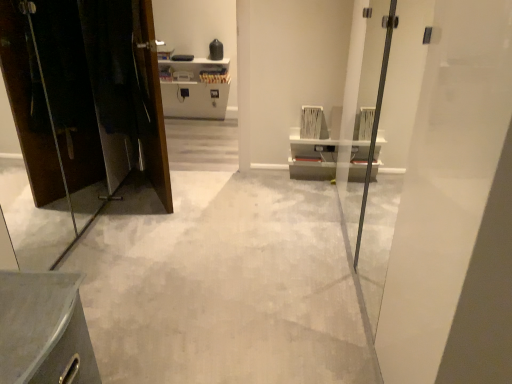
Where is `metallic gray cabinet at lower left`? metallic gray cabinet at lower left is located at coordinates (44, 330).

Measure the distance between gray concrete floor at center and camera.

The depth of gray concrete floor at center is 5.09 feet.

Locate an element on the screen. The height and width of the screenshot is (384, 512). matte black elevator at left is located at coordinates (81, 111).

You are a GUI agent. You are given a task and a screenshot of the screen. Output one action in this format:
    pyautogui.click(x=<x>, y=<y>)
    Task: Click on the elevator behind the white glossy door at right
    Image resolution: width=512 pixels, height=384 pixels.
    Given the screenshot: What is the action you would take?
    pyautogui.click(x=81, y=111)

Is white glossy door at right positioned with its back to matte black elevator at left?

No, white glossy door at right's orientation is not away from matte black elevator at left.

Between white glossy door at right and matte black elevator at left, which one has less height?

With less height is matte black elevator at left.

From a real-world perspective, is white glossy door at right under gray concrete floor at center?

Incorrect, from a real-world perspective, white glossy door at right is higher than gray concrete floor at center.

Is white glossy door at right oriented away from gray concrete floor at center?

No.

From the image's perspective, which one is positioned lower, white glossy door at right or gray concrete floor at center?

gray concrete floor at center.

I want to click on elevator that is on the left side of white glossy door at right, so click(81, 111).

From a real-world perspective, between matte black elevator at left and white glossy door at right, who is vertically lower?

matte black elevator at left is physically lower.

Considering their positions, is matte black elevator at left located in front of or behind white glossy door at right?

matte black elevator at left is behind white glossy door at right.

Is point (54, 368) positioned before point (200, 346)?

Yes, it is.

Consider the image. Measure the distance from metallic gray cabinet at lower left to gray concrete floor at center.

metallic gray cabinet at lower left is 33.59 inches from gray concrete floor at center.

Is metallic gray cabinet at lower left outside of gray concrete floor at center?

Yes, metallic gray cabinet at lower left is outside of gray concrete floor at center.

Is the surface of metallic gray cabinet at lower left in direct contact with gray concrete floor at center?

There is a gap between metallic gray cabinet at lower left and gray concrete floor at center.

From a real-world perspective, is matte black elevator at left above or below gray concrete floor at center?

Clearly, from a real-world perspective, matte black elevator at left is above gray concrete floor at center.

Which is correct: matte black elevator at left is inside gray concrete floor at center, or outside of it?

matte black elevator at left lies outside gray concrete floor at center.

Which object is wider, matte black elevator at left or gray concrete floor at center?

With larger width is gray concrete floor at center.

How different are the orientations of matte black elevator at left and gray concrete floor at center in degrees?

They differ by 90.2 degrees in their facing directions.

From their relative heights in the image, would you say metallic gray cabinet at lower left is taller or shorter than white glossy door at right?

Considering their sizes, metallic gray cabinet at lower left has less height than white glossy door at right.

From a real-world perspective, is metallic gray cabinet at lower left physically above white glossy door at right?

No, from a real-world perspective, metallic gray cabinet at lower left is not on top of white glossy door at right.

From the image's perspective, is metallic gray cabinet at lower left under white glossy door at right?

Correct, metallic gray cabinet at lower left appears lower than white glossy door at right in the image.

Can you confirm if metallic gray cabinet at lower left is wider than white glossy door at right?

In fact, metallic gray cabinet at lower left might be narrower than white glossy door at right.

Can you confirm if gray concrete floor at center is taller than matte black elevator at left?

In fact, gray concrete floor at center may be shorter than matte black elevator at left.

In the image, there is a matte black elevator at left. Where is `concrete below it (from a real-world perspective)`? The image size is (512, 384). concrete below it (from a real-world perspective) is located at coordinates (223, 285).

Which is more to the right, gray concrete floor at center or matte black elevator at left?

Positioned to the right is gray concrete floor at center.

Measure the distance between gray concrete floor at center and matte black elevator at left.

A distance of 26.06 inches exists between gray concrete floor at center and matte black elevator at left.

You are a GUI agent. You are given a task and a screenshot of the screen. Output one action in this format:
    pyautogui.click(x=<x>, y=<y>)
    Task: Click on the elevator below the white glossy door at right (from a real-world perspective)
    The image size is (512, 384).
    Given the screenshot: What is the action you would take?
    pyautogui.click(x=81, y=111)

Identify the location of door in front of the gray concrete floor at center. The height and width of the screenshot is (384, 512). (455, 210).

When comparing their distances from gray concrete floor at center, does white glossy door at right or metallic gray cabinet at lower left seem further?

white glossy door at right is positioned further to the anchor gray concrete floor at center.

Consider the image. Looking at the image, which one is located further to gray concrete floor at center, white glossy door at right or matte black elevator at left?

white glossy door at right is further to gray concrete floor at center.

Estimate the real-world distances between objects in this image. Which object is closer to white glossy door at right, gray concrete floor at center or matte black elevator at left?

The object closer to white glossy door at right is gray concrete floor at center.

Which object lies further to the anchor point metallic gray cabinet at lower left, white glossy door at right or gray concrete floor at center?

Based on the image, white glossy door at right appears to be further to metallic gray cabinet at lower left.

Considering their positions, is white glossy door at right positioned closer to metallic gray cabinet at lower left than matte black elevator at left?

The object closer to metallic gray cabinet at lower left is white glossy door at right.

Looking at the image, which one is located further to matte black elevator at left, white glossy door at right or metallic gray cabinet at lower left?

The object further to matte black elevator at left is white glossy door at right.

Which object lies further to the anchor point white glossy door at right, metallic gray cabinet at lower left or gray concrete floor at center?

metallic gray cabinet at lower left is further to white glossy door at right.

Looking at the image, which one is located closer to gray concrete floor at center, matte black elevator at left or metallic gray cabinet at lower left?

Among the two, matte black elevator at left is located nearer to gray concrete floor at center.

Locate an element on the screen. The width and height of the screenshot is (512, 384). concrete situated between matte black elevator at left and white glossy door at right from left to right is located at coordinates (223, 285).

You are a GUI agent. You are given a task and a screenshot of the screen. Output one action in this format:
    pyautogui.click(x=<x>, y=<y>)
    Task: Click on the concrete between matte black elevator at left and metallic gray cabinet at lower left in the vertical direction
    This screenshot has height=384, width=512.
    Given the screenshot: What is the action you would take?
    point(223,285)

Where is `furniture between matte black elevator at left and white glossy door at right from left to right`? furniture between matte black elevator at left and white glossy door at right from left to right is located at coordinates click(x=44, y=330).

Identify the location of concrete between metallic gray cabinet at lower left and white glossy door at right from left to right. (223, 285).